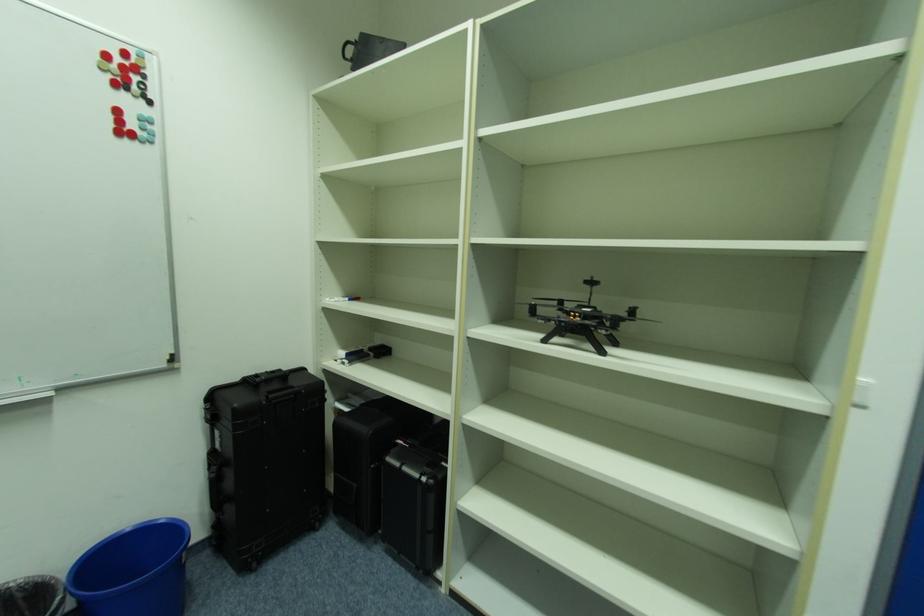
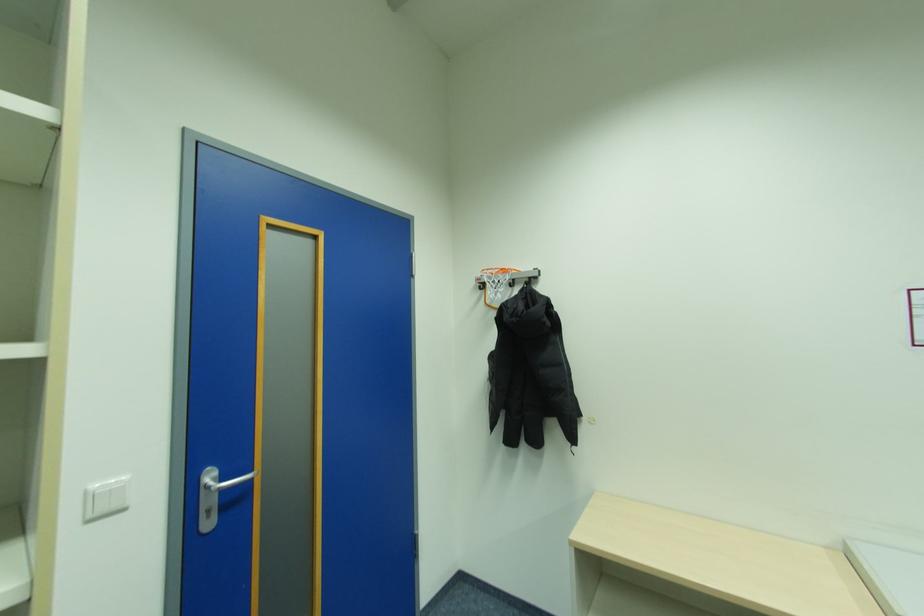
Question: The camera is either moving clockwise (left) or counter-clockwise (right) around the object. The first image is from the beginning of the video and the second image is from the end. Is the camera moving left or right when shooting the video?

Choices:
 (A) Left
 (B) Right

Answer: (A)